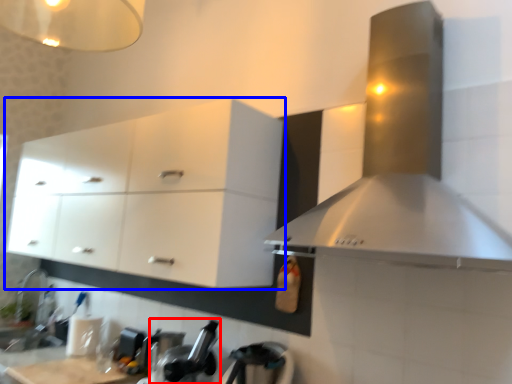
Question: Among these objects, which one is nearest to the camera, appliance (highlighted by a red box) or cabinetry (highlighted by a blue box)?

Choices:
 (A) appliance
 (B) cabinetry

Answer: (B)